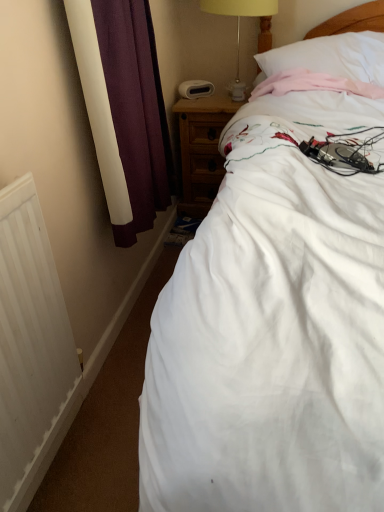
Question: Looking at the image, does white soft pillow at upper right seem bigger or smaller compared to yellow fabric lampshade at upper center?

Choices:
 (A) big
 (B) small

Answer: (A)

Question: Which is correct: white soft pillow at upper right is inside yellow fabric lampshade at upper center, or outside of it?

Choices:
 (A) inside
 (B) outside

Answer: (B)

Question: Which object is the closest to the white soft pillow at upper right?

Choices:
 (A) wooden nightstand at upper right
 (B) yellow fabric lampshade at upper center
 (C) white matte radiator at lower left
 (D) white cotton bed at center

Answer: (B)

Question: Which object is the farthest from the white cotton bed at center?

Choices:
 (A) wooden nightstand at upper right
 (B) white soft pillow at upper right
 (C) yellow fabric lampshade at upper center
 (D) white matte radiator at lower left

Answer: (C)